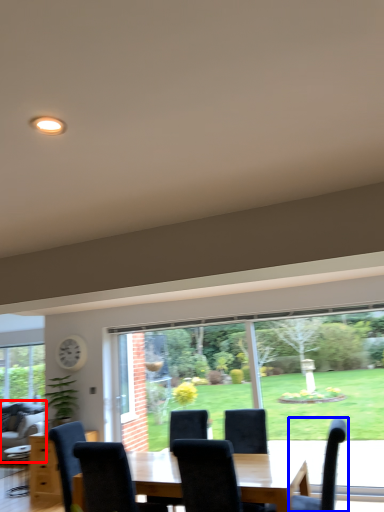
Question: Which of the following is the closest to the observer, couch (highlighted by a red box) or chair (highlighted by a blue box)?

Choices:
 (A) couch
 (B) chair

Answer: (B)